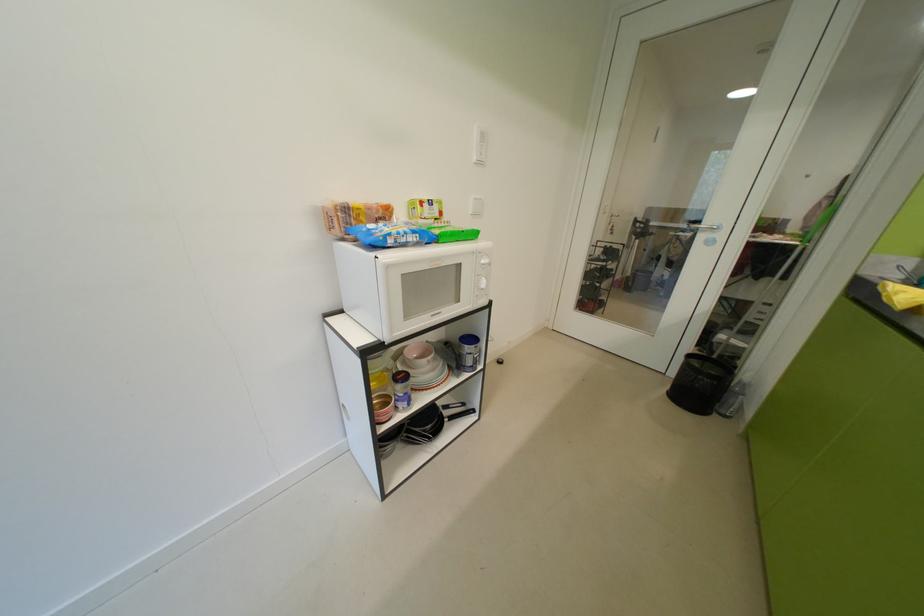
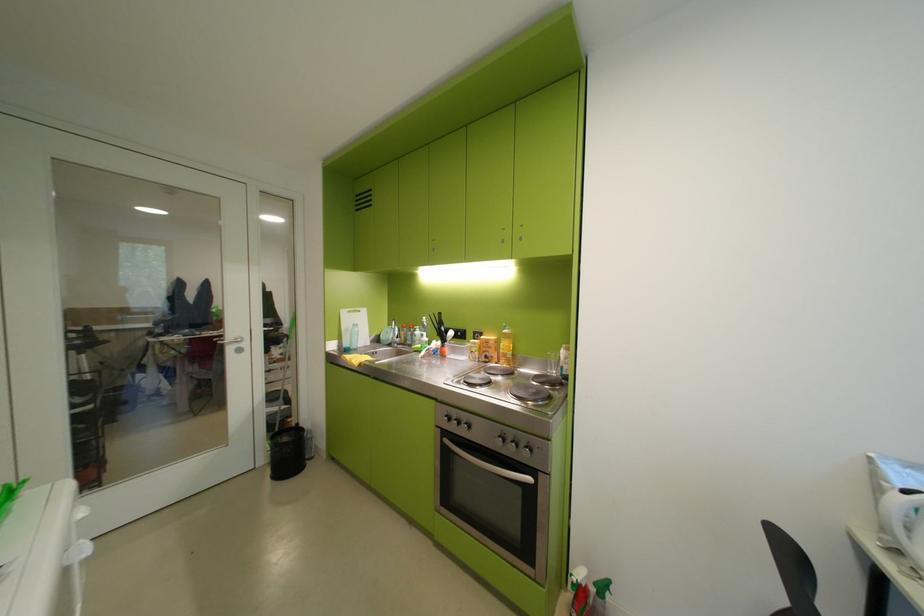
Find the pixel in the second image that matches point (706, 233) in the first image.

(233, 346)